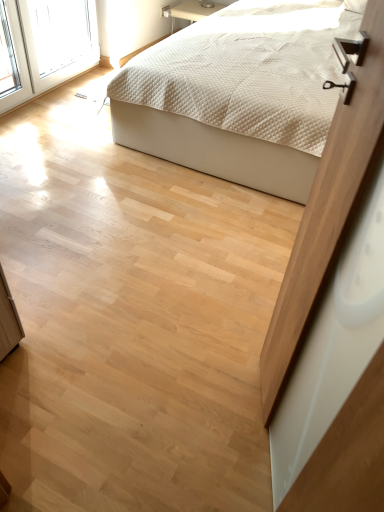
Describe the element at coordinates (327, 207) in the screenshot. I see `matte wood screen door at upper right` at that location.

This screenshot has height=512, width=384. What are the coordinates of `matte wood screen door at upper right` in the screenshot? It's located at (327, 207).

What is the approximate width of white quilted fabric bed at upper center?

The width of white quilted fabric bed at upper center is 2.24 meters.

This screenshot has height=512, width=384. What do you see at coordinates (239, 93) in the screenshot?
I see `white quilted fabric bed at upper center` at bounding box center [239, 93].

Identify the location of white quilted fabric bed at upper center. The height and width of the screenshot is (512, 384). (239, 93).

Image resolution: width=384 pixels, height=512 pixels. In order to click on matte wood screen door at upper right in this screenshot , I will do `click(327, 207)`.

Considering the relative positions of matte wood screen door at upper right and white quilted fabric bed at upper center in the image provided, is matte wood screen door at upper right to the right of white quilted fabric bed at upper center from the viewer's perspective?

Incorrect, matte wood screen door at upper right is not on the right side of white quilted fabric bed at upper center.

Which object is further away from the camera, matte wood screen door at upper right or white quilted fabric bed at upper center?

white quilted fabric bed at upper center is behind.

Does point (359, 117) come closer to viewer compared to point (248, 52)?

That is True.

From the image's perspective, which is above, matte wood screen door at upper right or white quilted fabric bed at upper center?

white quilted fabric bed at upper center.

From the picture: From a real-world perspective, does matte wood screen door at upper right sit lower than white quilted fabric bed at upper center?

Actually, matte wood screen door at upper right is physically above white quilted fabric bed at upper center in the real world.

Considering the sizes of matte wood screen door at upper right and white quilted fabric bed at upper center in the image, is matte wood screen door at upper right wider or thinner than white quilted fabric bed at upper center?

Clearly, matte wood screen door at upper right has less width compared to white quilted fabric bed at upper center.

Who is shorter, matte wood screen door at upper right or white quilted fabric bed at upper center?

white quilted fabric bed at upper center.

Is matte wood screen door at upper right smaller than white quilted fabric bed at upper center?

Indeed, matte wood screen door at upper right has a smaller size compared to white quilted fabric bed at upper center.

Is matte wood screen door at upper right not within white quilted fabric bed at upper center?

matte wood screen door at upper right lies outside white quilted fabric bed at upper center's area.

Is matte wood screen door at upper right touching white quilted fabric bed at upper center?

No, matte wood screen door at upper right is not making contact with white quilted fabric bed at upper center.

Is matte wood screen door at upper right positioned with its back to white quilted fabric bed at upper center?

No, matte wood screen door at upper right is not facing away from white quilted fabric bed at upper center.

Can you tell me how much matte wood screen door at upper right and white quilted fabric bed at upper center differ in facing direction?

65.9 degrees separate the facing orientations of matte wood screen door at upper right and white quilted fabric bed at upper center.

Find the location of a particular element. screen door below the white quilted fabric bed at upper center (from the image's perspective) is located at coordinates (327, 207).

Considering the positions of objects white quilted fabric bed at upper center and matte wood screen door at upper right in the image provided, who is more to the left, white quilted fabric bed at upper center or matte wood screen door at upper right?

matte wood screen door at upper right is more to the left.

Does white quilted fabric bed at upper center come in front of matte wood screen door at upper right?

No, white quilted fabric bed at upper center is further to the viewer.

Between point (253, 187) and point (321, 183), which one is positioned in front?

Point (321, 183)

From the picture: From the image's perspective, does white quilted fabric bed at upper center appear higher than matte wood screen door at upper right?

Yes, from the image's perspective, white quilted fabric bed at upper center is over matte wood screen door at upper right.

Based on the photo, from a real-world perspective, is white quilted fabric bed at upper center beneath matte wood screen door at upper right?

Yes, from a real-world perspective, white quilted fabric bed at upper center is beneath matte wood screen door at upper right.

Between white quilted fabric bed at upper center and matte wood screen door at upper right, which one has larger width?

Wider between the two is white quilted fabric bed at upper center.

Between white quilted fabric bed at upper center and matte wood screen door at upper right, which one has less height?

Standing shorter between the two is white quilted fabric bed at upper center.

Considering the sizes of white quilted fabric bed at upper center and matte wood screen door at upper right in the image, is white quilted fabric bed at upper center bigger or smaller than matte wood screen door at upper right?

white quilted fabric bed at upper center is bigger than matte wood screen door at upper right.

Is white quilted fabric bed at upper center not inside matte wood screen door at upper right?

white quilted fabric bed at upper center is positioned outside matte wood screen door at upper right.

Is white quilted fabric bed at upper center in contact with matte wood screen door at upper right?

No.

Does white quilted fabric bed at upper center turn towards matte wood screen door at upper right?

Yes, white quilted fabric bed at upper center is facing matte wood screen door at upper right.

Can you tell me how much white quilted fabric bed at upper center and matte wood screen door at upper right differ in facing direction?

There is a 65.9-degree angle between the facing directions of white quilted fabric bed at upper center and matte wood screen door at upper right.

How far apart are white quilted fabric bed at upper center and matte wood screen door at upper right?

white quilted fabric bed at upper center is 5.33 feet from matte wood screen door at upper right.

Identify the location of bed that is above the matte wood screen door at upper right (from the image's perspective). (239, 93).

Where is `bed on the right of the matte wood screen door at upper right`? The height and width of the screenshot is (512, 384). bed on the right of the matte wood screen door at upper right is located at coordinates (239, 93).

You are a GUI agent. You are given a task and a screenshot of the screen. Output one action in this format:
    pyautogui.click(x=<x>, y=<y>)
    Task: Click on the screen door in front of the white quilted fabric bed at upper center
    
    Given the screenshot: What is the action you would take?
    pyautogui.click(x=327, y=207)